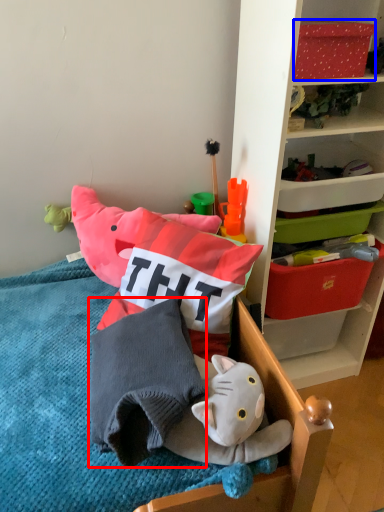
Question: Which point is further to the camera, pillow (highlighted by a red box) or storage box (highlighted by a blue box)?

Choices:
 (A) pillow
 (B) storage box

Answer: (B)